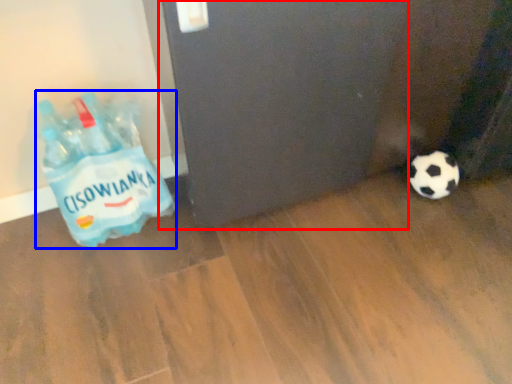
Question: Which object is closer to the camera taking this photo, screen door (highlighted by a red box) or bottle (highlighted by a blue box)?

Choices:
 (A) screen door
 (B) bottle

Answer: (A)